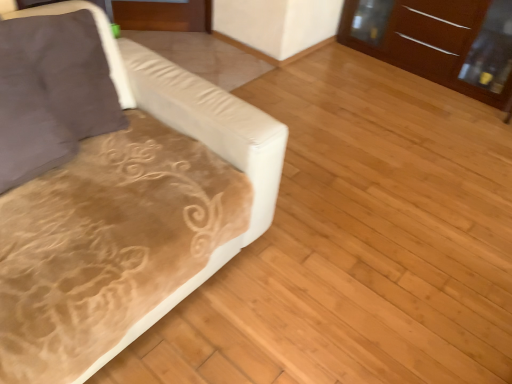
Image resolution: width=512 pixels, height=384 pixels. Find the location of `suede-like brown pillow at left`. suede-like brown pillow at left is located at coordinates (71, 69).

What is the approximate width of brown glossy dresser at upper right?

brown glossy dresser at upper right is 19.77 inches in width.

What do you see at coordinates (433, 42) in the screenshot?
I see `brown glossy dresser at upper right` at bounding box center [433, 42].

The image size is (512, 384). What do you see at coordinates (114, 190) in the screenshot?
I see `velvet beige couch at left` at bounding box center [114, 190].

Identify the location of suede-like brown pillow at left. (71, 69).

In order to click on pillow located in front of the brown glossy dresser at upper right in this screenshot , I will do `click(71, 69)`.

From a real-world perspective, between brown glossy dresser at upper right and suede-like brown pillow at left, who is vertically higher?

In real-world perspective, suede-like brown pillow at left is above.

What's the angular difference between brown glossy dresser at upper right and suede-like brown pillow at left's facing directions?

81.2 degrees.

Considering the positions of point (200, 262) and point (509, 61), is point (200, 262) closer or farther from the camera than point (509, 61)?

Point (200, 262) is closer to the camera than point (509, 61).

Which is more to the right, velvet beige couch at left or brown glossy dresser at upper right?

From the viewer's perspective, brown glossy dresser at upper right appears more on the right side.

Which object is thinner, velvet beige couch at left or brown glossy dresser at upper right?

brown glossy dresser at upper right is thinner.

Image resolution: width=512 pixels, height=384 pixels. In order to click on studio couch that is below the brown glossy dresser at upper right (from the image's perspective) in this screenshot , I will do `click(114, 190)`.

Does point (76, 102) appear closer or farther from the camera than point (92, 233)?

Point (76, 102) is farther from the camera than point (92, 233).

Is velvet beige couch at left inside suede-like brown pillow at left?

Actually, velvet beige couch at left is outside suede-like brown pillow at left.

What's the angular difference between suede-like brown pillow at left and velvet beige couch at left's facing directions?

8.83 degrees separate the facing orientations of suede-like brown pillow at left and velvet beige couch at left.

From a real-world perspective, is suede-like brown pillow at left located higher than brown glossy dresser at upper right?

Correct, in the physical world, suede-like brown pillow at left is higher than brown glossy dresser at upper right.

Is the depth of suede-like brown pillow at left greater than that of brown glossy dresser at upper right?

No, it is not.

In terms of width, does suede-like brown pillow at left look wider or thinner when compared to brown glossy dresser at upper right?

Considering their sizes, suede-like brown pillow at left looks slimmer than brown glossy dresser at upper right.

Based on their sizes in the image, would you say suede-like brown pillow at left is bigger or smaller than brown glossy dresser at upper right?

suede-like brown pillow at left is smaller than brown glossy dresser at upper right.

Which object is thinner, velvet beige couch at left or suede-like brown pillow at left?

Thinner between the two is suede-like brown pillow at left.

Is there a large distance between velvet beige couch at left and suede-like brown pillow at left?

velvet beige couch at left is near suede-like brown pillow at left, not far away.

Can you confirm if velvet beige couch at left is taller than suede-like brown pillow at left?

Yes, velvet beige couch at left is taller than suede-like brown pillow at left.

Is point (82, 164) closer or farther from the camera than point (104, 69)?

Point (82, 164) is positioned closer to the camera compared to point (104, 69).

Find the location of a particular element. dresser located behind the velvet beige couch at left is located at coordinates (x=433, y=42).

What's the angular difference between brown glossy dresser at upper right and velvet beige couch at left's facing directions?

90 degrees separate the facing orientations of brown glossy dresser at upper right and velvet beige couch at left.

Can you confirm if brown glossy dresser at upper right is taller than velvet beige couch at left?

In fact, brown glossy dresser at upper right may be shorter than velvet beige couch at left.

Where is `dresser on the right of suede-like brown pillow at left`? dresser on the right of suede-like brown pillow at left is located at coordinates (433, 42).

This screenshot has width=512, height=384. In order to click on studio couch on the left of brown glossy dresser at upper right in this screenshot , I will do `click(114, 190)`.

Based on their spatial positions, is suede-like brown pillow at left or velvet beige couch at left closer to brown glossy dresser at upper right?

velvet beige couch at left lies closer to brown glossy dresser at upper right than the other object.

Looking at the image, which one is located further to velvet beige couch at left, brown glossy dresser at upper right or suede-like brown pillow at left?

brown glossy dresser at upper right.

Estimate the real-world distances between objects in this image. Which object is closer to suede-like brown pillow at left, velvet beige couch at left or brown glossy dresser at upper right?

velvet beige couch at left is closer to suede-like brown pillow at left.

From the image, which object appears to be farther from brown glossy dresser at upper right, velvet beige couch at left or suede-like brown pillow at left?

The object further to brown glossy dresser at upper right is suede-like brown pillow at left.

When comparing their distances from velvet beige couch at left, does suede-like brown pillow at left or brown glossy dresser at upper right seem further?

Among the two, brown glossy dresser at upper right is located further to velvet beige couch at left.

Which object lies nearer to the anchor point suede-like brown pillow at left, brown glossy dresser at upper right or velvet beige couch at left?

velvet beige couch at left lies closer to suede-like brown pillow at left than the other object.

This screenshot has height=384, width=512. I want to click on studio couch situated between suede-like brown pillow at left and brown glossy dresser at upper right from left to right, so click(114, 190).